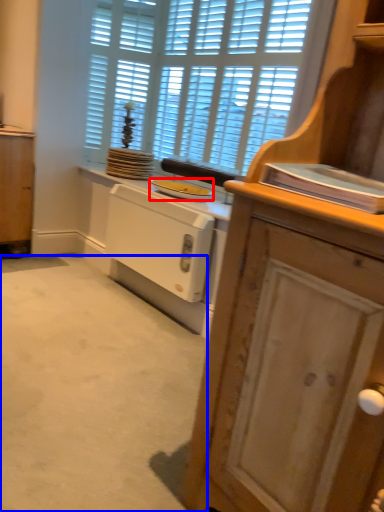
Question: Which object is further to the camera taking this photo, appliance (highlighted by a red box) or plain (highlighted by a blue box)?

Choices:
 (A) appliance
 (B) plain

Answer: (A)